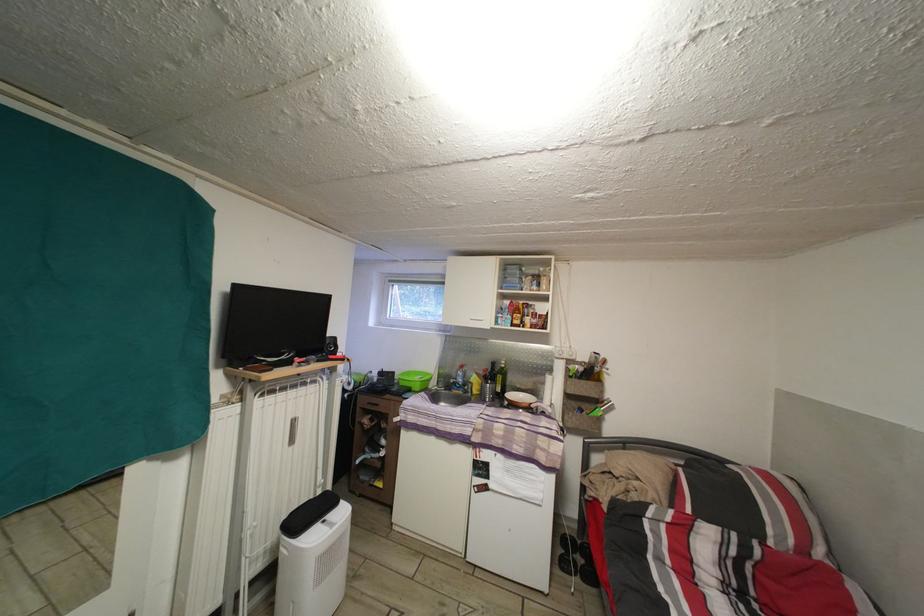
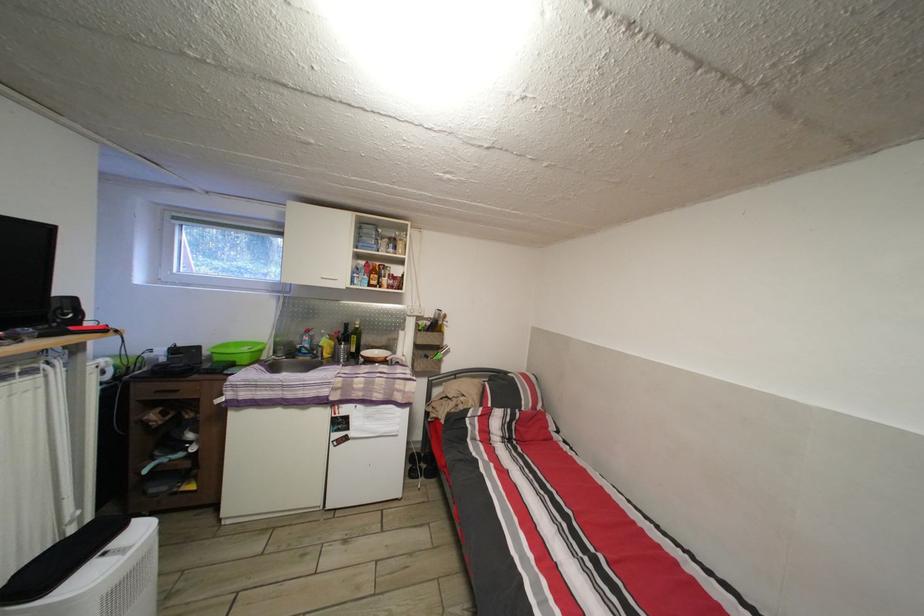
The point at [384,411] is marked in the first image. Where is the corresponding point in the second image?

(184, 398)